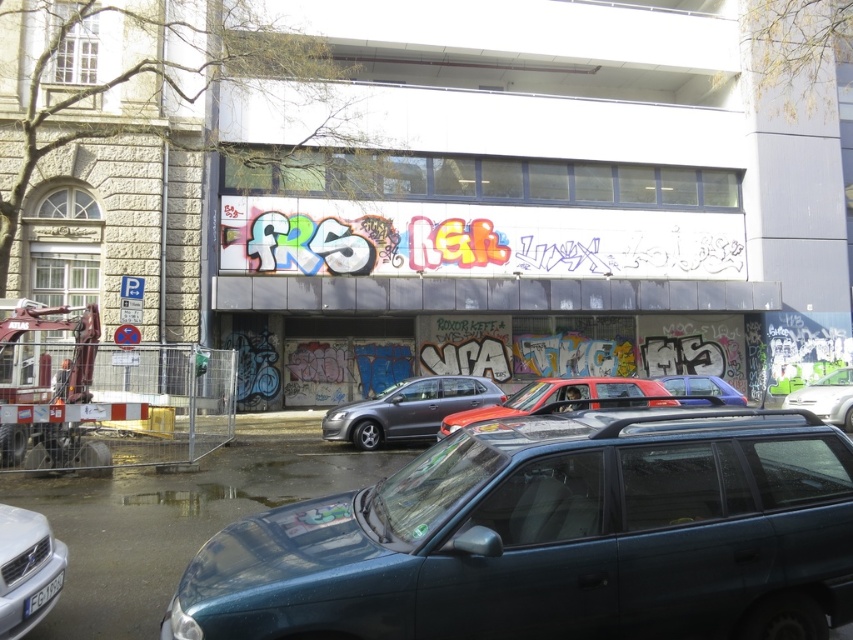
You are standing at the point marked as point [27,570] in the parking area. What vehicle are you currently standing on?

You are standing on the silver metallic car at lower left located at point [27,570].

You are a delivery driver who needs to back out of the parking spot between the metallic blue minivan at lower center and the matte gray car at center. Can you safely back out without hitting either vehicle?

The metallic blue minivan at lower center is in front of the matte gray car at center, so the matte gray car is behind the minivan. Since the minivan is blocking the path, you cannot safely back out without moving the minivan first.